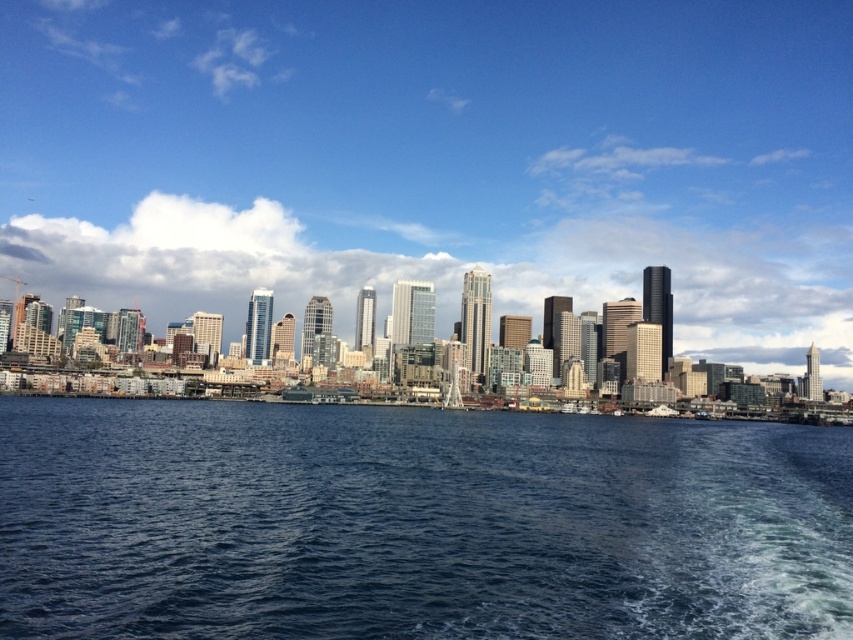
Consider the image. You are standing on a boat in the middle of the lake and looking at the city. You see the transparent glass skyscrapers at center and the blue water at center. Which one is located to the left side from your perspective?

The transparent glass skyscrapers at center are to the left of the blue water at center from your perspective.

Consider the image. You are an architect analyzing the cityscape from the boat. You notice the transparent glass skyscrapers at center and the blue water at center. Which of these two elements occupies a greater horizontal space in the scene?

The transparent glass skyscrapers at center have a greater width than the blue water at center, so they occupy more horizontal space in the scene.